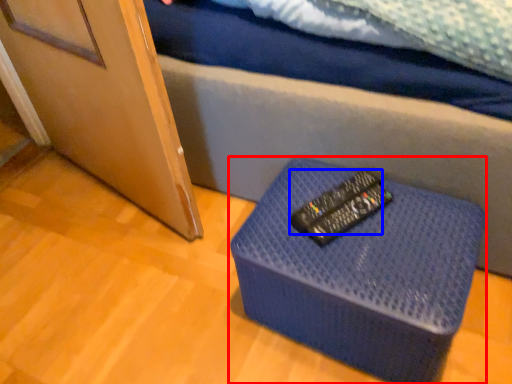
Question: Which of the following is the closest to the observer, furniture (highlighted by a red box) or control (highlighted by a blue box)?

Choices:
 (A) furniture
 (B) control

Answer: (A)